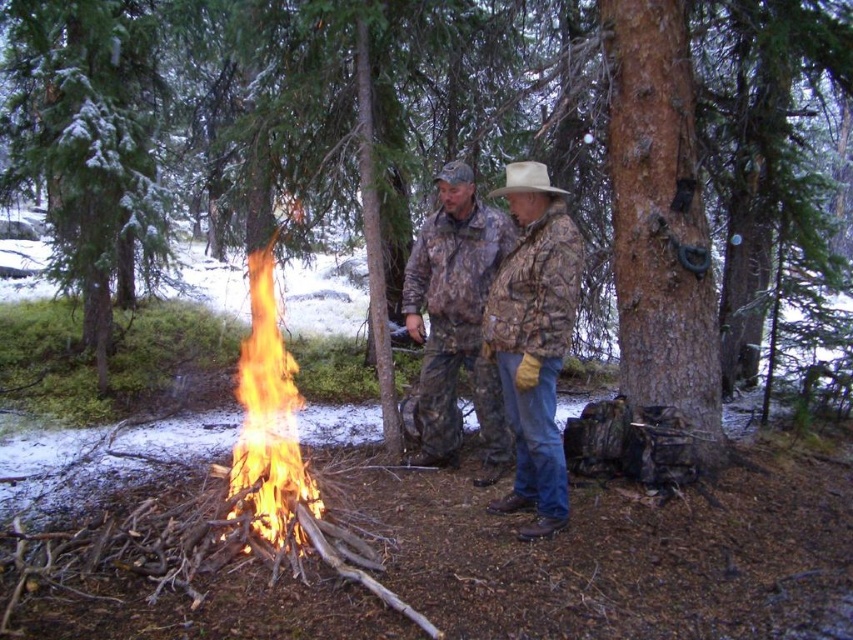
You are standing in the snowy forest scene and want to place a small decorative item between the two points labeled as point (672, 164) and point (265, 262). Which point should you place it closer to in order to make the item appear larger in the image?

To make the item appear larger in the image, you should place it closer to point (672, 164) because it is closer to the viewer than point (265, 262).

You are planning to take a photo of the brown rough tree at center and the camouflage jacket at center. Which object should you focus on first if you want to capture both in a single frame without moving the camera?

The brown rough tree at center is wider than the camouflage jacket at center, so you should focus on the camouflage jacket at center first to ensure it fits within the frame.